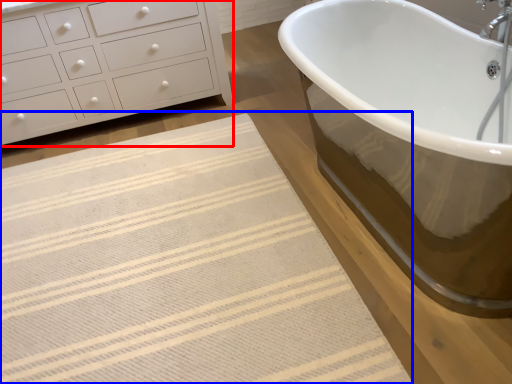
Question: Which point is further to the camera, chest of drawers (highlighted by a red box) or bath mat (highlighted by a blue box)?

Choices:
 (A) chest of drawers
 (B) bath mat

Answer: (A)